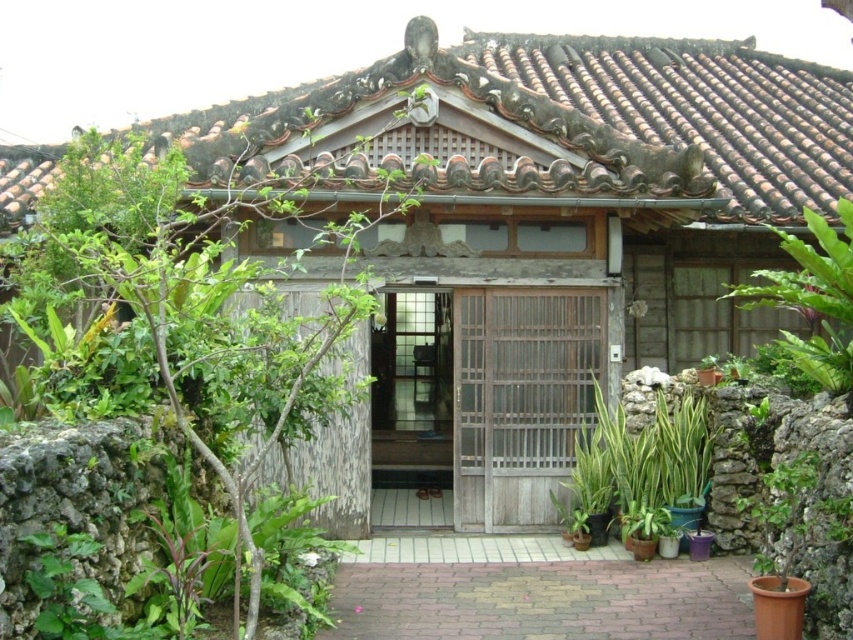
Question: Can you confirm if green leafy plant at left is bigger than green leafy plant at right?

Choices:
 (A) yes
 (B) no

Answer: (A)

Question: Which object is positioned closest to the weathered wood door at center?

Choices:
 (A) green leafy plant at left
 (B) green leafy plant at right
 (C) green leafy plant at center

Answer: (C)

Question: Which point appears closest to the camera in this image?

Choices:
 (A) (242, 204)
 (B) (675, 483)

Answer: (A)

Question: Which object is the farthest from the green leafy plant at center?

Choices:
 (A) weathered wood door at center
 (B) green leafy plant at left

Answer: (B)

Question: Where is green leafy plant at center located in relation to green leafy plant at right in the image?

Choices:
 (A) below
 (B) above

Answer: (A)

Question: Does green leafy plant at center appear under green leafy plant at right?

Choices:
 (A) no
 (B) yes

Answer: (B)